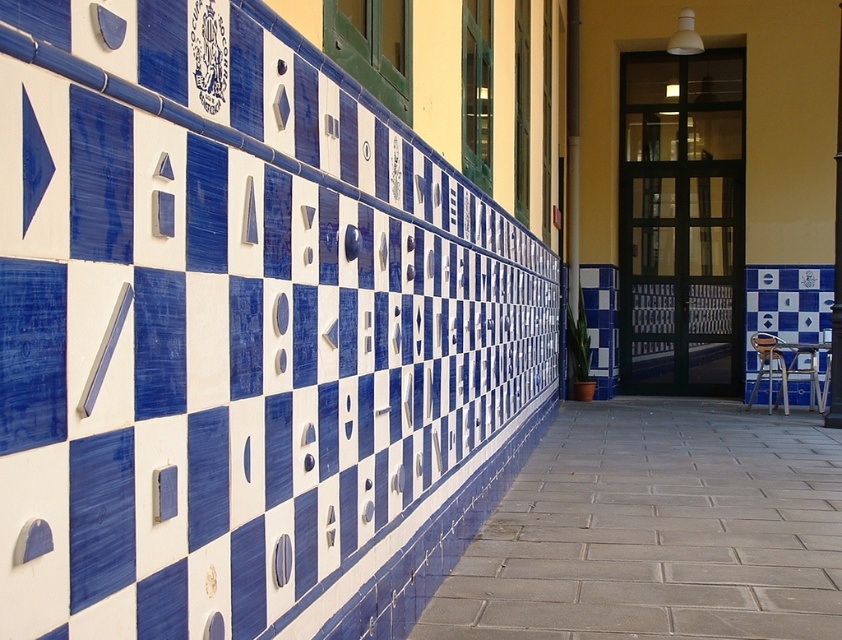
Question: Considering the relative positions of blue glossy tile at center and metallic silver chair at lower right in the image provided, where is blue glossy tile at center located with respect to metallic silver chair at lower right?

Choices:
 (A) below
 (B) above

Answer: (A)

Question: Which object is closer to the camera taking this photo?

Choices:
 (A) blue glossy tiles at upper left
 (B) blue glossy tile at center
 (C) metallic silver chair at lower right

Answer: (B)

Question: Is blue glossy tiles at upper left wider than blue glossy tile at center?

Choices:
 (A) yes
 (B) no

Answer: (B)

Question: Which of the following is the farthest from the observer?

Choices:
 (A) metallic silver chair at lower right
 (B) blue glossy tiles at upper left
 (C) blue glossy tile at center

Answer: (A)

Question: Which is farther from the blue glossy tile at center?

Choices:
 (A) metallic silver chair at lower right
 (B) blue glossy tiles at upper left

Answer: (B)

Question: Is blue glossy tile at center below metallic silver chair at lower right?

Choices:
 (A) no
 (B) yes

Answer: (B)